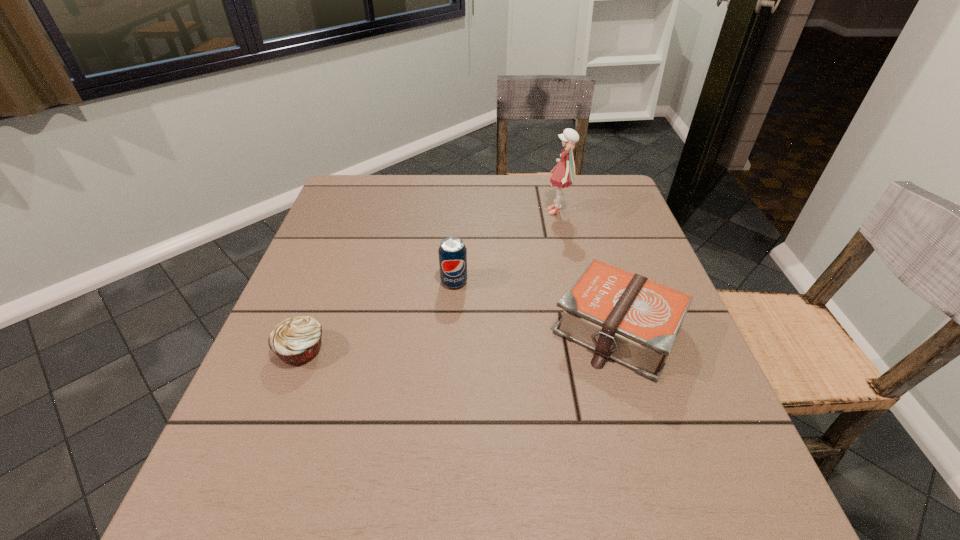
Identify the location of the farthest object. (563, 176).

Where is `the tallest object`? the tallest object is located at coordinates (563, 176).

You are a GUI agent. You are given a task and a screenshot of the screen. Output one action in this format:
    pyautogui.click(x=<x>, y=<y>)
    Task: Click on the soda can
    
    Given the screenshot: What is the action you would take?
    pyautogui.click(x=452, y=252)

I want to click on the second tallest object, so click(x=452, y=252).

Identify the location of Bible. (634, 321).

The height and width of the screenshot is (540, 960). I want to click on the shortest object, so (296, 340).

At what (x,y) coordinates should I click in order to perform the action: click on muffin. Please return your answer as a coordinate pair (x, y). Looking at the image, I should click on (296, 340).

Find the location of a particular element. free space located 0.190m on the front-facing side of the farthest object is located at coordinates (475, 212).

Locate an element on the screen. The height and width of the screenshot is (540, 960). vacant space located on the front-facing side of the farthest object is located at coordinates (490, 212).

Locate an element on the screen. The image size is (960, 540). vacant space located 0.310m on the front-facing side of the farthest object is located at coordinates (431, 212).